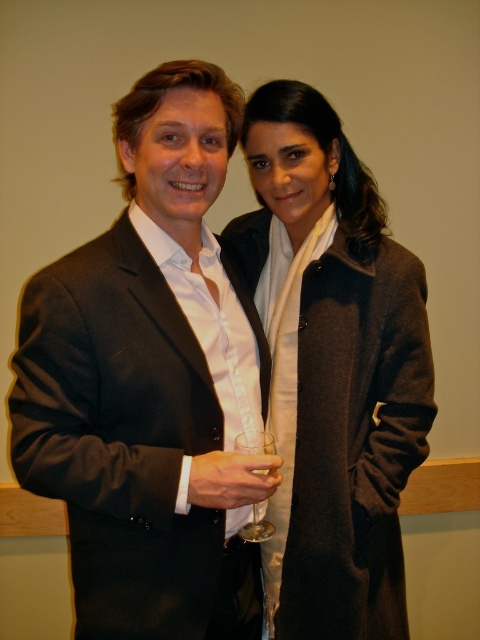
In order to click on black matte suit at left in this screenshot , I will do `click(151, 381)`.

Does black matte suit at left have a larger size compared to clear glass wine glass at center?

Indeed, black matte suit at left has a larger size compared to clear glass wine glass at center.

This screenshot has width=480, height=640. I want to click on black matte suit at left, so click(x=151, y=381).

Which is behind, point (194, 202) or point (305, 492)?

The point (305, 492) is behind.

Is black matte suit at left below matte gray coat at center?

Yes, black matte suit at left is below matte gray coat at center.

Does point (139, 621) come in front of point (342, 579)?

Yes, point (139, 621) is in front of point (342, 579).

In order to click on black matte suit at left in this screenshot , I will do `click(151, 381)`.

This screenshot has height=640, width=480. Find the location of `matte gray coat at center`. matte gray coat at center is located at coordinates (333, 369).

Between point (367, 362) and point (265, 436), which one is positioned in front?

Positioned in front is point (265, 436).

Is point (369, 212) farther from camera compared to point (275, 451)?

Yes, it is behind point (275, 451).

What are the coordinates of `matte gray coat at center` in the screenshot? It's located at (333, 369).